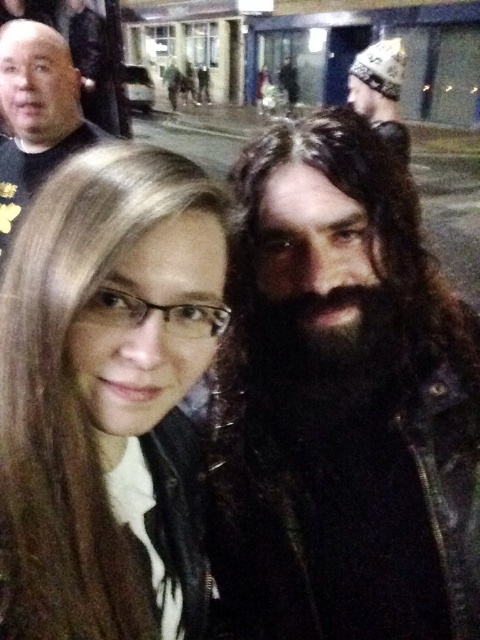
Question: Is matte black jacket at center above dark brown thick hair at center?

Choices:
 (A) no
 (B) yes

Answer: (A)

Question: Which point is farther to the camera?

Choices:
 (A) dark brown leather jacket at right
 (B) black leather jacket at upper left

Answer: (B)

Question: Does dark brown thick hair at center have a greater width compared to black leather jacket at upper left?

Choices:
 (A) yes
 (B) no

Answer: (B)

Question: Which point is closer to the camera?

Choices:
 (A) matte black jacket at center
 (B) black leather jacket at upper left
 (C) dark brown leather jacket at right

Answer: (A)

Question: Which of these objects is positioned closest to the dark brown thick hair at center?

Choices:
 (A) matte black jacket at center
 (B) dark brown leather jacket at right
 (C) black leather jacket at upper left

Answer: (B)

Question: Is dark brown thick hair at center positioned behind black leather jacket at upper left?

Choices:
 (A) no
 (B) yes

Answer: (A)